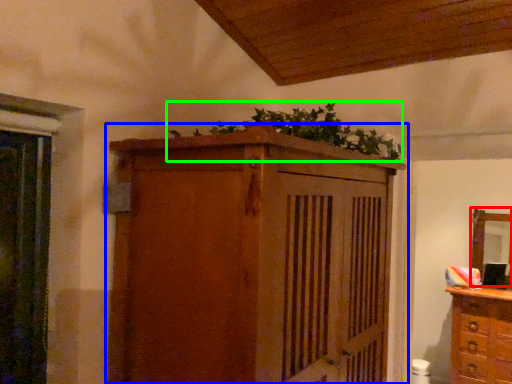
Question: Which object is the farthest from mirror (highlighted by a red box)? Choose among these: cupboard (highlighted by a blue box) or plant (highlighted by a green box).

Choices:
 (A) cupboard
 (B) plant

Answer: (A)